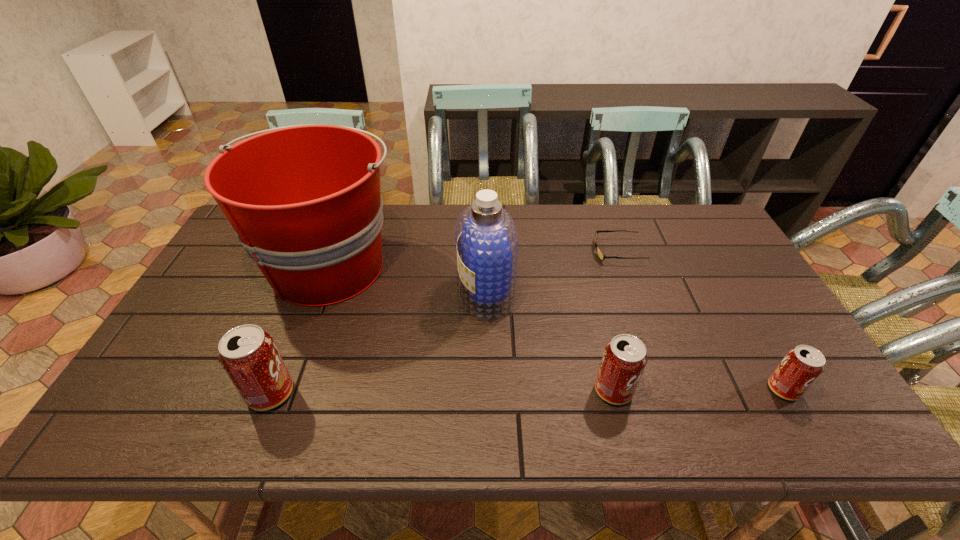
The image size is (960, 540). Identify the location of free region located on the left of the leftmost soda can. (223, 393).

At what (x,y) coordinates should I click in order to perform the action: click on vacant space situated 0.150m on the right of the second soda can from left to right. Please return your answer as a coordinate pair (x, y). This screenshot has height=540, width=960. Looking at the image, I should click on (696, 390).

Locate an element on the screen. vacant space situated 0.120m on the left of the rightmost soda can is located at coordinates (718, 389).

The width and height of the screenshot is (960, 540). I want to click on vacant area located 0.310m on the front-facing side of the shortest object, so click(497, 251).

This screenshot has height=540, width=960. What are the coordinates of `free space located on the front-facing side of the shortest object` in the screenshot? It's located at (491, 251).

This screenshot has width=960, height=540. Identify the location of free point located 0.160m on the front-facing side of the shortest object. (543, 251).

Image resolution: width=960 pixels, height=540 pixels. Identify the location of free location located 0.170m on the right of the bucket. (457, 266).

Where is `free spot located 0.120m on the back of the cleansing agent`? This screenshot has height=540, width=960. free spot located 0.120m on the back of the cleansing agent is located at coordinates (485, 244).

I want to click on sunglasses located at the far edge, so click(601, 255).

Locate an element on the screen. This screenshot has height=540, width=960. bucket present at the far edge is located at coordinates (304, 200).